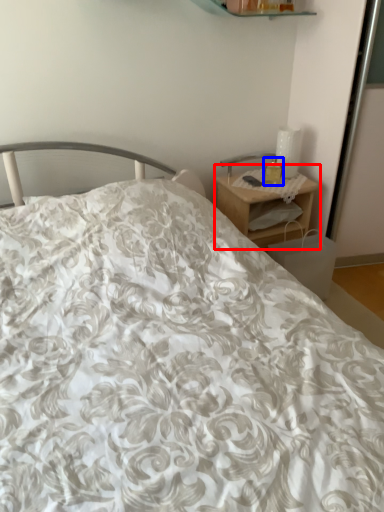
Question: Which object appears farthest to the camera in this image, nightstand (highlighted by a red box) or candle holder (highlighted by a blue box)?

Choices:
 (A) nightstand
 (B) candle holder

Answer: (B)